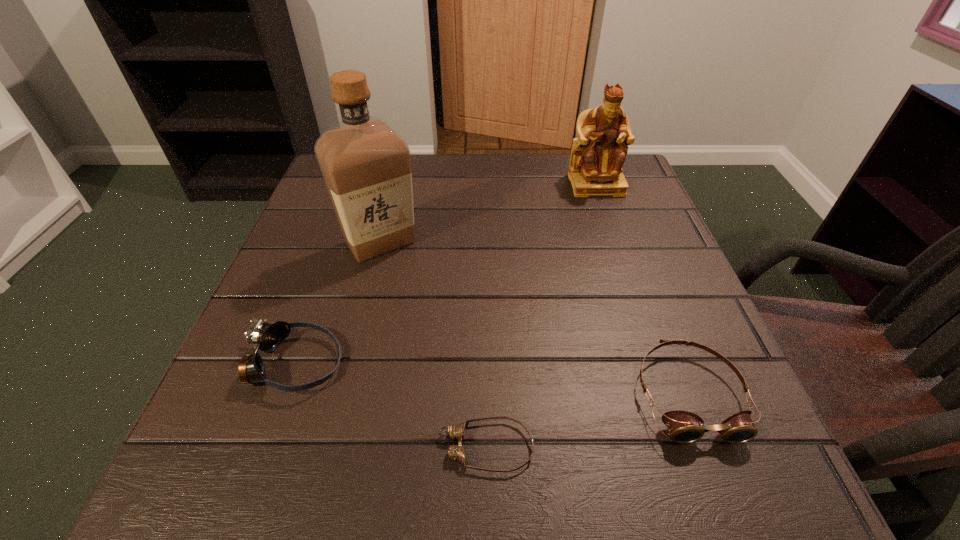
This screenshot has width=960, height=540. Identify the location of vacant space located 0.080m through the lenses of the leftmost goggles. (393, 364).

At what (x,y) coordinates should I click in order to perform the action: click on vacant space located 0.060m through the lenses of the rightmost goggles. Please return your answer as a coordinate pair (x, y). The width and height of the screenshot is (960, 540). Looking at the image, I should click on (726, 491).

In order to click on vacant space located 0.280m on the front lenses and sides of the shortest goggles in this screenshot , I will do `click(234, 447)`.

The height and width of the screenshot is (540, 960). I want to click on vacant space located on the front lenses and sides of the shortest goggles, so click(249, 447).

What are the coordinates of `vacant point located 0.340m on the front lenses and sides of the shortest goggles` in the screenshot? It's located at (190, 447).

Find the location of a particular element. object that is at the far edge is located at coordinates (598, 154).

This screenshot has width=960, height=540. Identify the location of liquor located in the left edge section of the desktop. (366, 166).

The width and height of the screenshot is (960, 540). Identify the location of goggles at the left edge. (266, 337).

This screenshot has width=960, height=540. I want to click on figurine at the right edge, so click(598, 154).

Where is `goggles that is at the right edge`? goggles that is at the right edge is located at coordinates (684, 427).